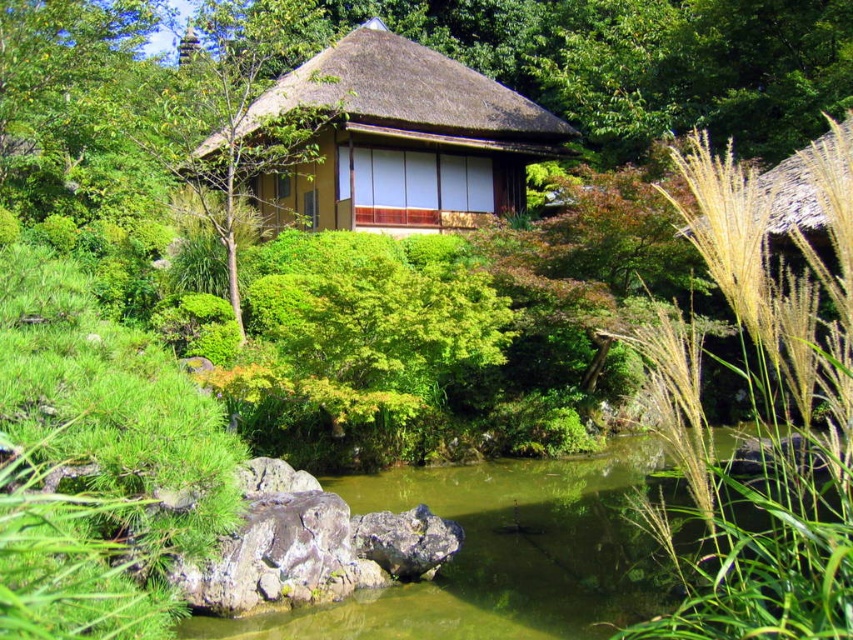
You are a visitor in the Japanese garden and want to take a photo of the golden grass at right and the matte brown thatched hut at center. Which object will appear smaller in your photo?

The golden grass at right will appear smaller in the photo because it has a lesser height compared to the matte brown thatched hut at center.